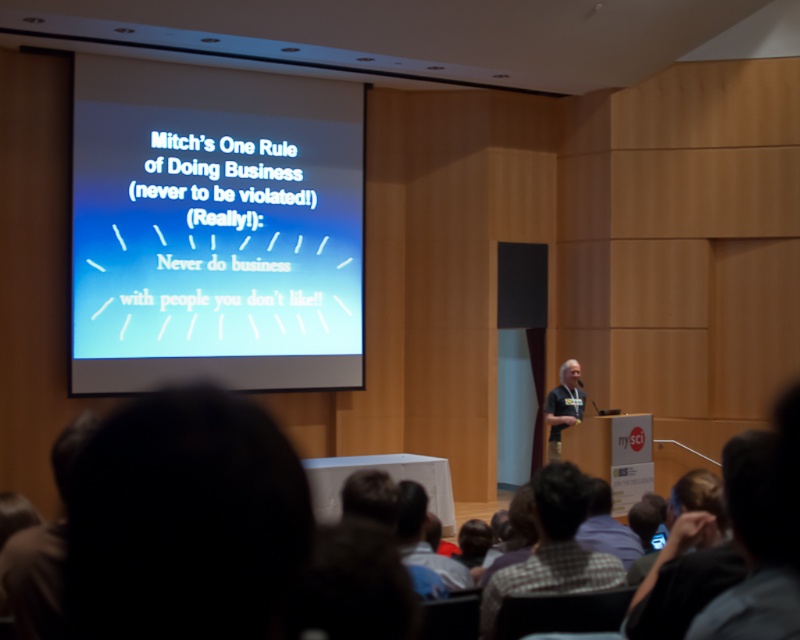
You are an attendee sitting in the conference room and want to take a photo of the slide on the white matte projector screen at upper center. The screen is located at coordinates point (214,228). If your camera has a standard 50mm lens, will you be able to capture the entire screen in one shot without moving your position? Please explain your reasoning based on the screen location and size.

The point (214,228) indicates the white matte projector screen at upper center. Since the screen is at the upper center position, using a standard 50mm lens should allow you to capture the entire screen in one shot without needing to move, as the lens provides a natural field of view that aligns with typical human vision and the screen is centrally positioned.

You are an attendee sitting in the conference room and you want to take a photo of the checkered shirt at lower center without the white matte projector screen at upper center in the frame. Is this possible?

The white matte projector screen at upper center is above the checkered shirt at lower center, so if you position your camera to exclude the upper part of the frame, you can capture the checkered shirt at lower center without the screen.

You are an event planner organizing a formal business meeting. You need to choose between two shirts for the presenter based on the image provided. The checkered shirt at lower center and the dark gray shirt at center are both options. Which shirt should the presenter wear to match the formal atmosphere of the conference room?

The dark gray shirt at center is more appropriate for the formal atmosphere since it is larger in size compared to the checkered shirt at lower center, suggesting a more professional and authoritative presence.